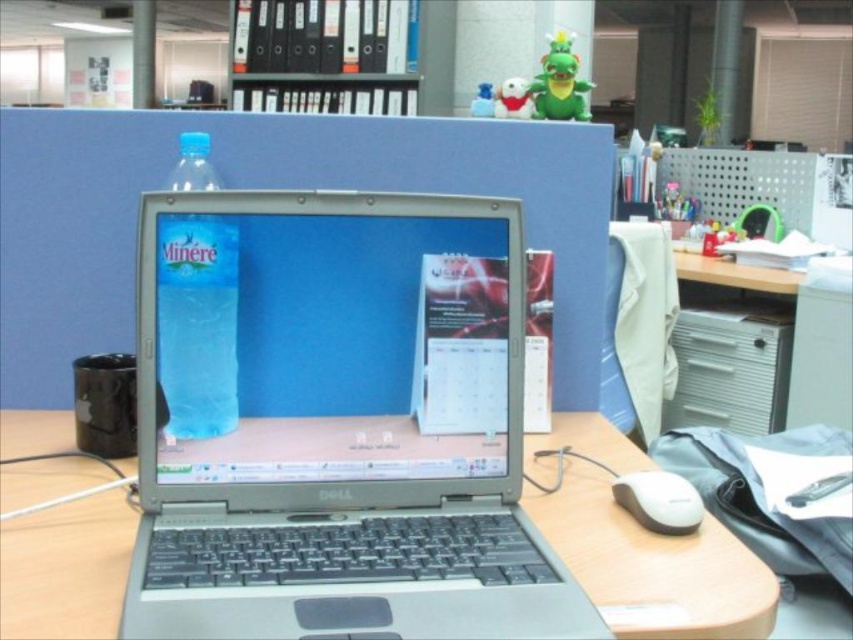
Question: Is wooden desk at center wider than white matte mouse at lower right?

Choices:
 (A) yes
 (B) no

Answer: (A)

Question: Based on their relative distances, which object is farther from the white matte mouse at lower right?

Choices:
 (A) blue plastic bottle at center
 (B) silver metallic laptop at center

Answer: (A)

Question: Can you confirm if wooden desk at center is wider than blue plastic bottle at center?

Choices:
 (A) no
 (B) yes

Answer: (B)

Question: Is wooden desk at center closer to the viewer compared to blue plastic bottle at center?

Choices:
 (A) no
 (B) yes

Answer: (B)

Question: Estimate the real-world distances between objects in this image. Which object is closer to the blue plastic bottle at center?

Choices:
 (A) white matte mouse at lower right
 (B) wooden desk at center
 (C) silver metallic laptop at center

Answer: (C)

Question: Which point appears farthest from the camera in this image?

Choices:
 (A) (187, 406)
 (B) (670, 502)

Answer: (B)